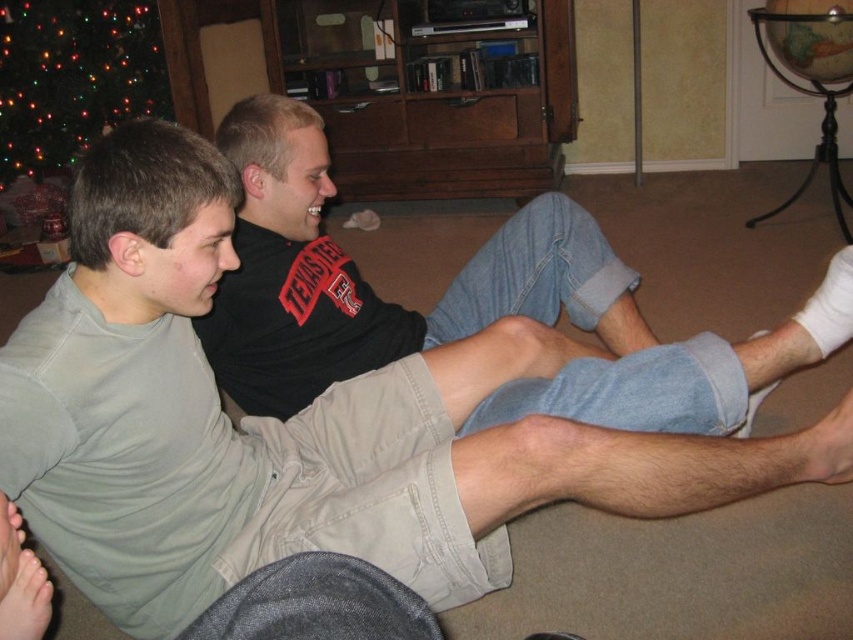
You are standing in the living room and want to place a small potted plant between the two points, point (445, 312) and point (44, 108). Which point should the plant be closer to if you want it to be nearer to the viewer?

The plant should be placed closer to point (445, 312) because it is closer to the viewer than point (44, 108).

You are a photographer positioned in front of the two people sitting on the floor. You want to take a photo that clearly shows both the light gray cotton pants at center and the green glittering lights at upper left. Which object will appear larger in the photo?

The light gray cotton pants at center will appear larger in the photo because it is closer to the viewer than the green glittering lights at upper left.

You are a tailor measuring for a new pair of pants. You see the light gray cotton pants at center and the green glittering lights at upper left. Which object is wider?

The light gray cotton pants at center is wider than the green glittering lights at upper left.